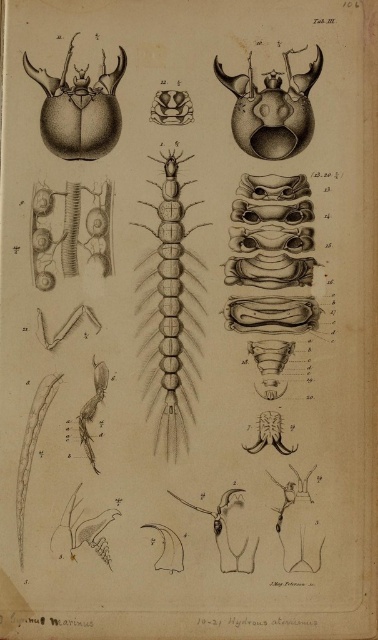
Question: Which of the following is the closest to the observer?

Choices:
 (A) (170, 260)
 (B) (30, 76)

Answer: (A)

Question: Does grayish-brown segmented centipede at center appear on the right side of matte black beetle at upper left?

Choices:
 (A) no
 (B) yes

Answer: (B)

Question: Which object appears closest to the camera in this image?

Choices:
 (A) matte black beetle at upper left
 (B) matte black beetle at upper center
 (C) grayish-brown segmented centipede at center

Answer: (C)

Question: Can you confirm if grayish-brown segmented centipede at center is positioned to the right of matte black beetle at upper left?

Choices:
 (A) no
 (B) yes

Answer: (B)

Question: Is grayish-brown segmented centipede at center closer to camera compared to matte black beetle at upper left?

Choices:
 (A) yes
 (B) no

Answer: (A)

Question: Among these points, which one is farthest from the camera?

Choices:
 (A) (170, 198)
 (B) (298, 150)

Answer: (A)